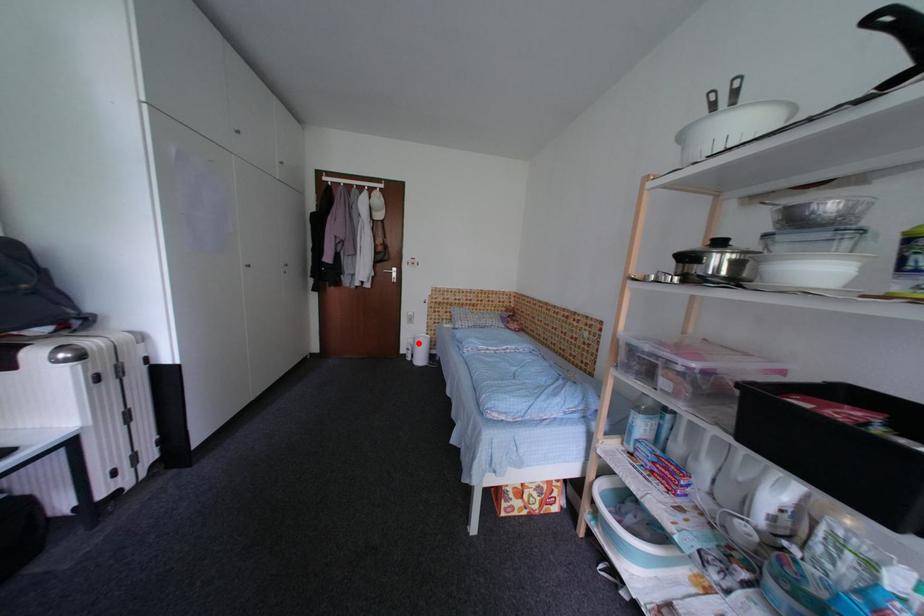
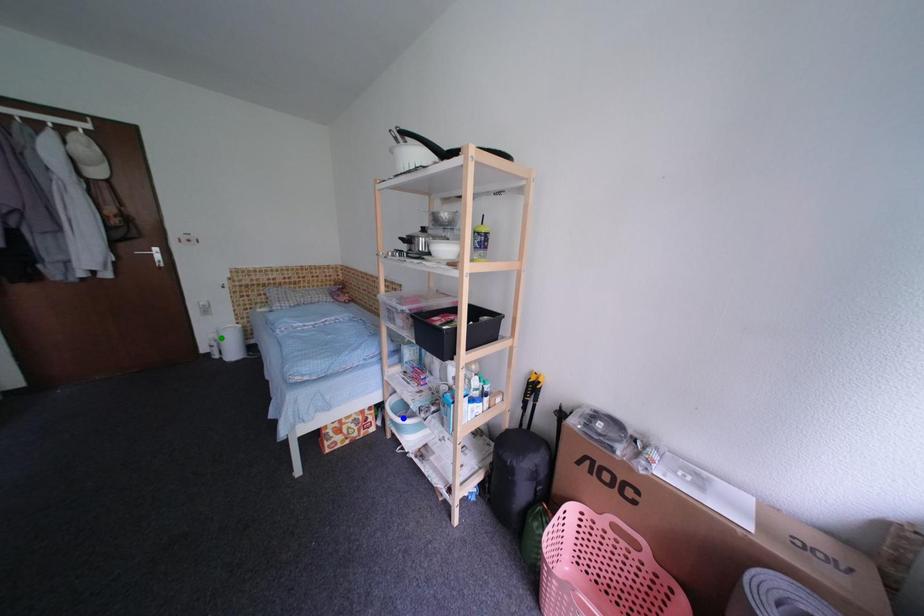
Question: I am providing you with two images of the same scene from different viewpoints. A red point is marked on the first image. You are given multiple points on the second image. Can you choose the point in image 2 that corresponds to the point in image 1?

Choices:
 (A) yellow point
 (B) blue point
 (C) green point

Answer: (C)